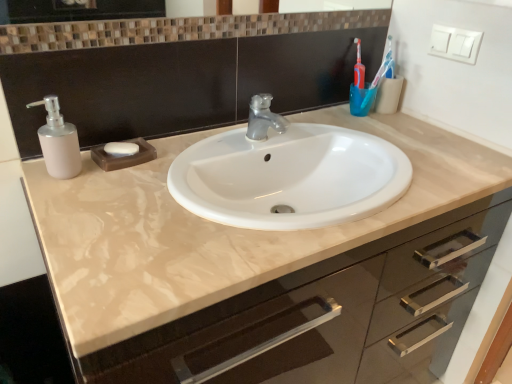
Question: Does brown mosaic tile mirror at upper center contain white matte soap at center?

Choices:
 (A) no
 (B) yes

Answer: (A)

Question: From a real-world perspective, is brown mosaic tile mirror at upper center positioned under white matte soap at center based on gravity?

Choices:
 (A) yes
 (B) no

Answer: (B)

Question: From the image's perspective, is brown mosaic tile mirror at upper center below white matte soap at center?

Choices:
 (A) no
 (B) yes

Answer: (A)

Question: Could you tell me if brown mosaic tile mirror at upper center is turned towards white matte soap at center?

Choices:
 (A) no
 (B) yes

Answer: (A)

Question: Is brown mosaic tile mirror at upper center thinner than white matte soap at center?

Choices:
 (A) no
 (B) yes

Answer: (B)

Question: Is brown mosaic tile mirror at upper center in front of or behind matte beige cabinet at center in the image?

Choices:
 (A) front
 (B) behind

Answer: (B)

Question: From a real-world perspective, is brown mosaic tile mirror at upper center positioned above or below matte beige cabinet at center?

Choices:
 (A) below
 (B) above

Answer: (B)

Question: In the image, is brown mosaic tile mirror at upper center on the left side or the right side of matte beige cabinet at center?

Choices:
 (A) left
 (B) right

Answer: (A)

Question: From the image's perspective, relative to matte beige cabinet at center, is brown mosaic tile mirror at upper center above or below?

Choices:
 (A) below
 (B) above

Answer: (B)

Question: In terms of width, does matte white soap dispenser at left look wider or thinner when compared to white matte soap at center?

Choices:
 (A) thin
 (B) wide

Answer: (B)

Question: From the image's perspective, is matte white soap dispenser at left above or below white matte soap at center?

Choices:
 (A) below
 (B) above

Answer: (B)

Question: Considering the positions of point (46, 130) and point (117, 145), is point (46, 130) closer or farther from the camera than point (117, 145)?

Choices:
 (A) farther
 (B) closer

Answer: (B)

Question: Is matte white soap dispenser at left inside the boundaries of white matte soap at center, or outside?

Choices:
 (A) inside
 (B) outside

Answer: (B)

Question: Considering the positions of blue plastic toothbrush at upper right and brown mosaic tile mirror at upper center in the image, is blue plastic toothbrush at upper right bigger or smaller than brown mosaic tile mirror at upper center?

Choices:
 (A) small
 (B) big

Answer: (A)

Question: Looking at their shapes, would you say blue plastic toothbrush at upper right is wider or thinner than brown mosaic tile mirror at upper center?

Choices:
 (A) wide
 (B) thin

Answer: (A)